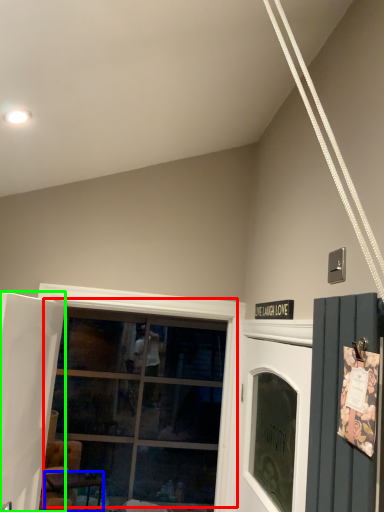
Question: Which is farther away from window (highlighted by a red box)? table (highlighted by a blue box) or door (highlighted by a green box)?

Choices:
 (A) table
 (B) door

Answer: (B)